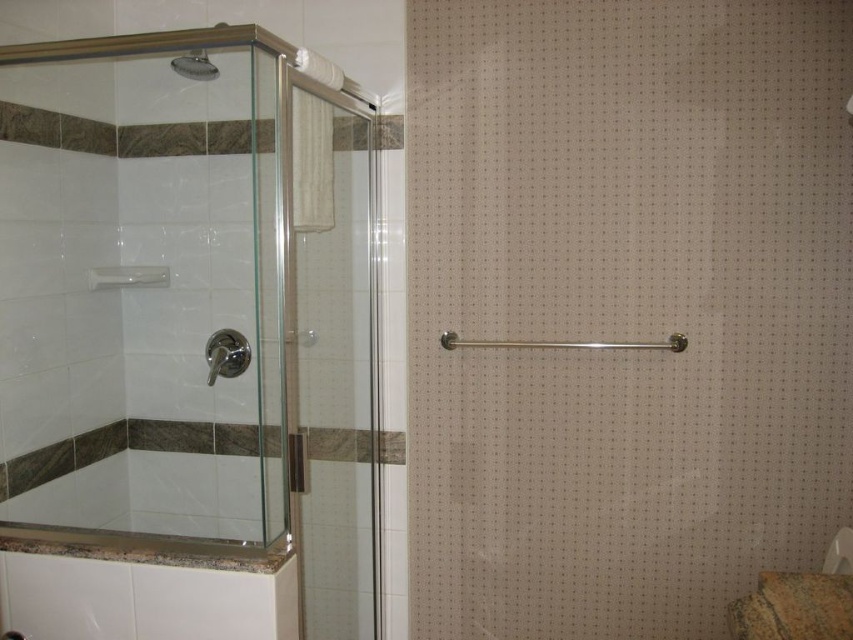
You are designing a bathroom layout and need to ensure proper spacing between the brushed metal showerhead at left and the brushed metal shower head at upper left. According to the image, which one requires more space due to its size?

The brushed metal showerhead at left requires more space because it is larger in size than the brushed metal shower head at upper left.

From the picture: You are a contractor measuring bathroom fixtures. You need to install a new shower curtain rod that must be 2 inches shorter than the height of the clear glass shower door at left. Can the rod also fit over the brown marble toilet bowl at lower right if its height is within the same measurement?

The clear glass shower door at left is taller than the brown marble toilet bowl at lower right. Since the shower curtain rod is 2 inches shorter than the shower door, it may still be taller than the toilet bowl. Therefore, the rod might not fit over the toilet bowl as it could exceed its height.

You are standing in the bathroom and want to reach a point marked at coordinates point (x=363, y=250). The grab bar is 2 feet long. Can you safely reach the point without stretching beyond the grab bar?

The distance between you and point (x=363, y=250) is 6.60 feet, which is longer than the grab bar length of 2 feet. Therefore, you cannot safely reach the point without stretching beyond the grab bar.